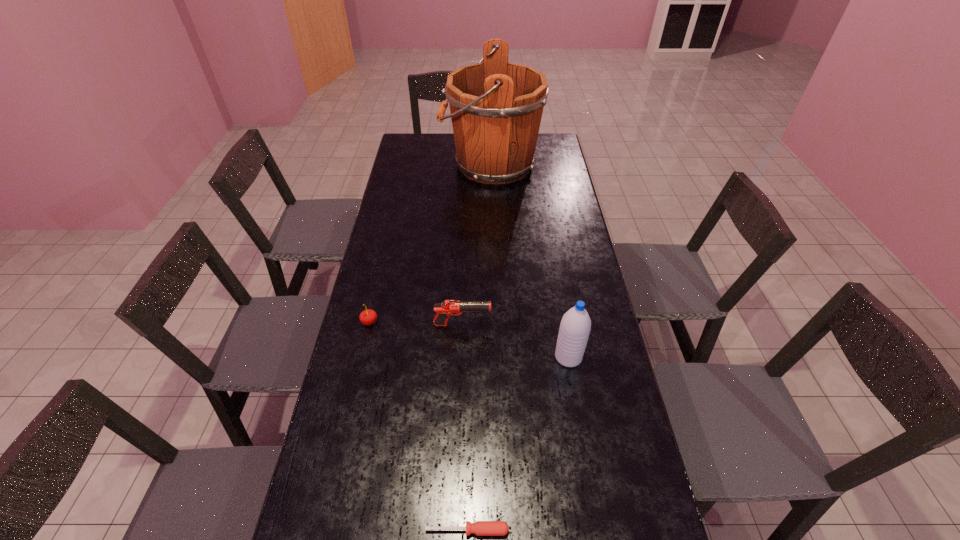
The width and height of the screenshot is (960, 540). I want to click on object that is at the far right corner, so click(x=496, y=107).

This screenshot has height=540, width=960. In order to click on vacant area at the far edge of the desktop in this screenshot , I will do `click(439, 158)`.

You are a GUI agent. You are given a task and a screenshot of the screen. Output one action in this format:
    pyautogui.click(x=<x>, y=<y>)
    Task: Click on the free space at the left edge of the desktop
    
    Given the screenshot: What is the action you would take?
    pyautogui.click(x=394, y=263)

The image size is (960, 540). Identify the location of free location at the right edge. (606, 381).

In the image, there is a desktop. Identify the location of vacant space at the far left corner. (408, 146).

Find the location of a particular element. vacant area between the screwdriver and the second shortest object is located at coordinates (419, 426).

The width and height of the screenshot is (960, 540). Find the location of `unoccupied position between the nearest object and the gun`. unoccupied position between the nearest object and the gun is located at coordinates (465, 427).

Identify the location of vacant area between the nearest object and the gun. (465, 427).

Find the location of a particular element. free space between the water bottle and the cherry is located at coordinates (468, 339).

Image resolution: width=960 pixels, height=540 pixels. What are the coordinates of `free point between the fourth shortest object and the gun` in the screenshot? It's located at (516, 341).